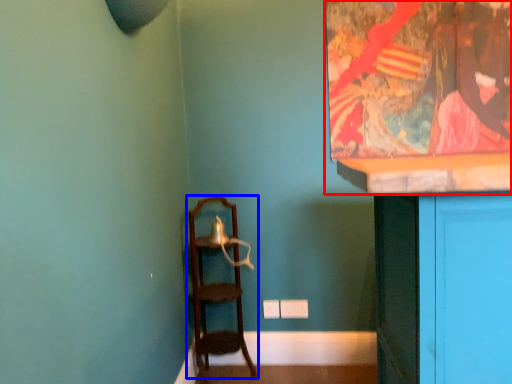
Question: Which point is closer to the camera, picture frame (highlighted by a red box) or furniture (highlighted by a blue box)?

Choices:
 (A) picture frame
 (B) furniture

Answer: (B)